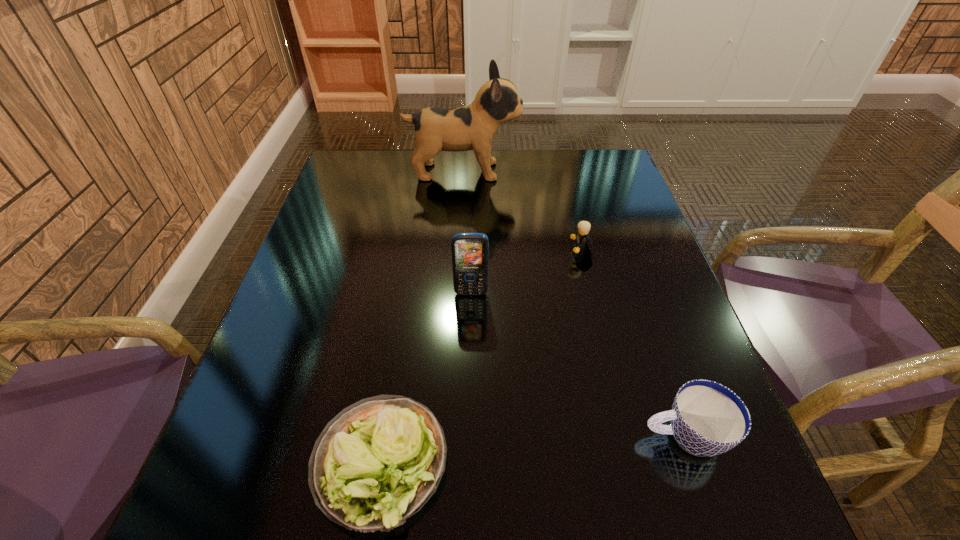
The image size is (960, 540). In order to click on puppy in this screenshot , I will do `click(473, 127)`.

I want to click on the farthest object, so click(x=473, y=127).

You are a GUI agent. You are given a task and a screenshot of the screen. Output one action in this format:
    pyautogui.click(x=<x>, y=<y>)
    Task: Click on the cellular telephone
    This screenshot has height=540, width=960.
    Given the screenshot: What is the action you would take?
    pyautogui.click(x=470, y=251)

Identify the location of the third farthest object. The height and width of the screenshot is (540, 960). (470, 251).

Where is `the fourth nearest object`? This screenshot has width=960, height=540. the fourth nearest object is located at coordinates (581, 236).

Locate an element on the screen. cup is located at coordinates (707, 419).

Identify the location of lettuce. (376, 463).

Find the location of `vacant space located 0.150m at the face of the puppy`. vacant space located 0.150m at the face of the puppy is located at coordinates (569, 171).

This screenshot has width=960, height=540. I want to click on vacant space located 0.270m on the screen of the third farthest object, so click(468, 412).

In order to click on free location located on the front-facing side of the second farthest object in this screenshot , I will do `click(538, 251)`.